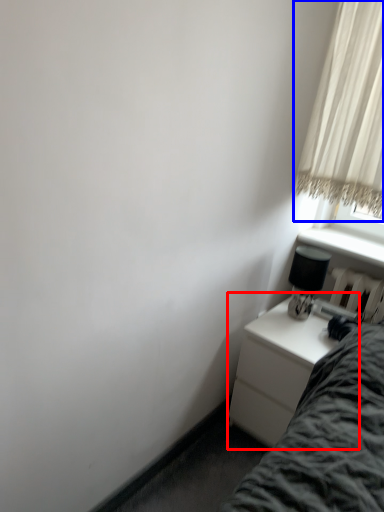
Question: Which object appears farthest to the camera in this image, nightstand (highlighted by a red box) or curtain (highlighted by a blue box)?

Choices:
 (A) nightstand
 (B) curtain

Answer: (A)